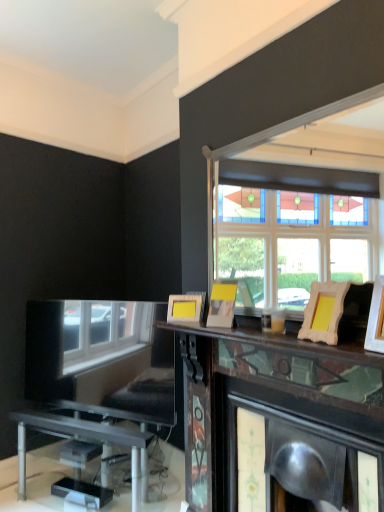
What do you see at coordinates (324, 312) in the screenshot? The image size is (384, 512). I see `wooden picture frame at upper right, which ranks as the second picture frame in right-to-left order` at bounding box center [324, 312].

Where is `wooden picture frame at right, arranged as the first picture frame when viewed from the front`? The width and height of the screenshot is (384, 512). wooden picture frame at right, arranged as the first picture frame when viewed from the front is located at coordinates (376, 318).

The height and width of the screenshot is (512, 384). What do you see at coordinates (376, 318) in the screenshot?
I see `wooden picture frame at right, arranged as the first picture frame when viewed from the front` at bounding box center [376, 318].

Locate an element on the screen. This screenshot has height=512, width=384. yellow matte picture frame at center, acting as the 4th picture frame starting from the front is located at coordinates (184, 308).

Where is `wooden picture frame at upper right, arranged as the 2th picture frame when viewed from the front`? The image size is (384, 512). wooden picture frame at upper right, arranged as the 2th picture frame when viewed from the front is located at coordinates (324, 312).

Measure the distance from yellow matte picture frame at center, which is the 1th picture frame in left-to-right order, to yellow matte picture frame at upper center, which appears as the second picture frame when viewed from the back.

yellow matte picture frame at center, which is the 1th picture frame in left-to-right order, and yellow matte picture frame at upper center, which appears as the second picture frame when viewed from the back, are 8.54 inches apart.

From a real-world perspective, who is located higher, yellow matte picture frame at center, the first picture frame viewed from the back, or yellow matte picture frame at upper center, which appears as the second picture frame when viewed from the back?

From a 3D spatial view, yellow matte picture frame at upper center, which appears as the second picture frame when viewed from the back, is above.

Is point (177, 313) farther from camera compared to point (230, 325)?

Yes, point (177, 313) is behind point (230, 325).

From the image's perspective, does yellow matte picture frame at center, the first picture frame viewed from the back, appear higher than yellow matte picture frame at upper center, the third picture frame viewed from the front?

No, from the image's perspective, yellow matte picture frame at center, the first picture frame viewed from the back, is not on top of yellow matte picture frame at upper center, the third picture frame viewed from the front.

Is yellow matte picture frame at upper center, which appears as the second picture frame when viewed from the back, with yellow matte picture frame at center, which is the 1th picture frame in left-to-right order?

yellow matte picture frame at upper center, which appears as the second picture frame when viewed from the back, and yellow matte picture frame at center, which is the 1th picture frame in left-to-right order, are clearly separated.

Who is shorter, yellow matte picture frame at upper center, the third picture frame viewed from the front, or yellow matte picture frame at center, acting as the 4th picture frame starting from the front?

yellow matte picture frame at center, acting as the 4th picture frame starting from the front, is shorter.

Is point (218, 318) in front of point (193, 306)?

Yes, point (218, 318) is closer to viewer.

Based on their sizes in the image, would you say yellow matte picture frame at upper center, which appears as the second picture frame when viewed from the back, is bigger or smaller than yellow matte picture frame at center, which is the 1th picture frame in left-to-right order?

Considering their sizes, yellow matte picture frame at upper center, which appears as the second picture frame when viewed from the back, takes up more space than yellow matte picture frame at center, which is the 1th picture frame in left-to-right order.

From a real-world perspective, is yellow matte picture frame at upper center, the second picture frame when ordered from left to right, physically located above or below wooden picture frame at right, which is the first picture frame from right to left?

In terms of real-world spatial position, yellow matte picture frame at upper center, the second picture frame when ordered from left to right, is above wooden picture frame at right, which is the first picture frame from right to left.

Are yellow matte picture frame at upper center, the 3th picture frame positioned from the right, and wooden picture frame at right, which is the first picture frame from right to left, far apart?

No, yellow matte picture frame at upper center, the 3th picture frame positioned from the right, is in close proximity to wooden picture frame at right, which is the first picture frame from right to left.

Considering the points (231, 287) and (372, 349), which point is behind, point (231, 287) or point (372, 349)?

Point (231, 287)

Does yellow matte picture frame at upper center, the 3th picture frame positioned from the right, have a lesser height compared to wooden picture frame at right, arranged as the 4th picture frame when viewed from the back?

Correct, yellow matte picture frame at upper center, the 3th picture frame positioned from the right, is not as tall as wooden picture frame at right, arranged as the 4th picture frame when viewed from the back.

Which of these two, wooden picture frame at right, which is the first picture frame from right to left, or yellow matte picture frame at center, acting as the 4th picture frame starting from the front, is thinner?

With smaller width is yellow matte picture frame at center, acting as the 4th picture frame starting from the front.

Would you say wooden picture frame at right, which is the first picture frame from right to left, is to the left or to the right of yellow matte picture frame at center, the 4th picture frame from the right, in the picture?

From the image, it's evident that wooden picture frame at right, which is the first picture frame from right to left, is to the right of yellow matte picture frame at center, the 4th picture frame from the right.

Is yellow matte picture frame at center, acting as the 4th picture frame starting from the front, at the back of wooden picture frame at right, which is the first picture frame from right to left?

wooden picture frame at right, which is the first picture frame from right to left, is not turned away from yellow matte picture frame at center, acting as the 4th picture frame starting from the front.

Considering the points (233, 313) and (332, 310), which point is behind, point (233, 313) or point (332, 310)?

The point (233, 313) is more distant.

Find the location of `the 2nd picture frame located beneath the yellow matte picture frame at upper center, the third picture frame viewed from the front (from a real-world perspective)`. the 2nd picture frame located beneath the yellow matte picture frame at upper center, the third picture frame viewed from the front (from a real-world perspective) is located at coordinates (324, 312).

From a real-world perspective, which is physically above, yellow matte picture frame at upper center, which appears as the second picture frame when viewed from the back, or wooden picture frame at upper right, which is counted as the 3th picture frame, starting from the back?

From a 3D spatial view, yellow matte picture frame at upper center, which appears as the second picture frame when viewed from the back, is above.

Which of these two, yellow matte picture frame at upper center, the third picture frame viewed from the front, or wooden picture frame at upper right, which is counted as the 3th picture frame, starting from the back, stands taller?

wooden picture frame at upper right, which is counted as the 3th picture frame, starting from the back.

Would you say yellow matte picture frame at center, acting as the 4th picture frame starting from the front, is to the left or to the right of wooden picture frame at right, arranged as the 4th picture frame when viewed from the back, in the picture?

From the image, it's evident that yellow matte picture frame at center, acting as the 4th picture frame starting from the front, is to the left of wooden picture frame at right, arranged as the 4th picture frame when viewed from the back.

How distant is yellow matte picture frame at center, the 4th picture frame from the right, from wooden picture frame at right, arranged as the 4th picture frame when viewed from the back?

They are 35.87 inches apart.

Based on their sizes in the image, would you say yellow matte picture frame at center, the first picture frame viewed from the back, is bigger or smaller than wooden picture frame at right, which is the first picture frame from right to left?

Clearly, yellow matte picture frame at center, the first picture frame viewed from the back, is smaller in size than wooden picture frame at right, which is the first picture frame from right to left.

Which picture frame is the 3rd one when counting from the right side of the yellow matte picture frame at center, which is the 1th picture frame in left-to-right order? Please provide its 2D coordinates.

[(376, 318)]

Does wooden picture frame at upper right, acting as the third picture frame starting from the left, turn towards yellow matte picture frame at center, acting as the 4th picture frame starting from the front?

No, wooden picture frame at upper right, acting as the third picture frame starting from the left, is not oriented towards yellow matte picture frame at center, acting as the 4th picture frame starting from the front.

How different are the orientations of wooden picture frame at upper right, acting as the third picture frame starting from the left, and yellow matte picture frame at center, the first picture frame viewed from the back, in degrees?

39.5 degrees.

Is there a large distance between wooden picture frame at upper right, acting as the third picture frame starting from the left, and yellow matte picture frame at center, which is the 1th picture frame in left-to-right order?

No.

From a real-world perspective, which picture frame is the 3rd one above the yellow matte picture frame at center, acting as the 4th picture frame starting from the front? Please provide its 2D coordinates.

[(222, 304)]

The image size is (384, 512). Identify the location of picture frame that is the 1st one when counting forward from the yellow matte picture frame at center, the 4th picture frame from the right. (222, 304).

Estimate the real-world distances between objects in this image. Which object is closer to wooden picture frame at right, the fourth picture frame viewed from the left, yellow matte picture frame at center, acting as the 4th picture frame starting from the front, or yellow matte picture frame at upper center, the third picture frame viewed from the front?

yellow matte picture frame at upper center, the third picture frame viewed from the front, is positioned closer to the anchor wooden picture frame at right, the fourth picture frame viewed from the left.

Based on their spatial positions, is wooden picture frame at right, which is the first picture frame from right to left, or wooden picture frame at upper right, which ranks as the second picture frame in right-to-left order, closer to yellow matte picture frame at upper center, the second picture frame when ordered from left to right?

wooden picture frame at upper right, which ranks as the second picture frame in right-to-left order, is positioned closer to the anchor yellow matte picture frame at upper center, the second picture frame when ordered from left to right.

Looking at the image, which one is located further to yellow matte picture frame at center, the 4th picture frame from the right, wooden picture frame at right, the fourth picture frame viewed from the left, or wooden picture frame at upper right, acting as the third picture frame starting from the left?

Among the two, wooden picture frame at right, the fourth picture frame viewed from the left, is located further to yellow matte picture frame at center, the 4th picture frame from the right.

Looking at this image, considering their positions, is wooden picture frame at right, the fourth picture frame viewed from the left, positioned further to wooden picture frame at upper right, arranged as the 2th picture frame when viewed from the front, than yellow matte picture frame at upper center, the third picture frame viewed from the front?

yellow matte picture frame at upper center, the third picture frame viewed from the front, is further to wooden picture frame at upper right, arranged as the 2th picture frame when viewed from the front.

Based on the photo, from the image, which object appears to be farther from wooden picture frame at right, which is the first picture frame from right to left, wooden picture frame at upper right, arranged as the 2th picture frame when viewed from the front, or yellow matte picture frame at center, the first picture frame viewed from the back?

Based on the image, yellow matte picture frame at center, the first picture frame viewed from the back, appears to be further to wooden picture frame at right, which is the first picture frame from right to left.

From the image, which object appears to be farther from wooden picture frame at right, arranged as the first picture frame when viewed from the front, yellow matte picture frame at upper center, the third picture frame viewed from the front, or yellow matte picture frame at center, the first picture frame viewed from the back?

Among the two, yellow matte picture frame at center, the first picture frame viewed from the back, is located further to wooden picture frame at right, arranged as the first picture frame when viewed from the front.

Which object lies nearer to the anchor point yellow matte picture frame at center, the first picture frame viewed from the back, wooden picture frame at upper right, which is counted as the 3th picture frame, starting from the back, or yellow matte picture frame at upper center, the second picture frame when ordered from left to right?

Among the two, yellow matte picture frame at upper center, the second picture frame when ordered from left to right, is located nearer to yellow matte picture frame at center, the first picture frame viewed from the back.

From the image, which object appears to be farther from wooden picture frame at upper right, acting as the third picture frame starting from the left, wooden picture frame at right, the fourth picture frame viewed from the left, or yellow matte picture frame at center, the 4th picture frame from the right?

yellow matte picture frame at center, the 4th picture frame from the right, lies further to wooden picture frame at upper right, acting as the third picture frame starting from the left, than the other object.

Identify the location of picture frame between wooden picture frame at upper right, arranged as the 2th picture frame when viewed from the front, and yellow matte picture frame at center, the first picture frame viewed from the back, in the front-back direction. (222, 304).

Identify the location of picture frame positioned between wooden picture frame at right, the fourth picture frame viewed from the left, and yellow matte picture frame at upper center, the 3th picture frame positioned from the right, from near to far. This screenshot has height=512, width=384. (324, 312).